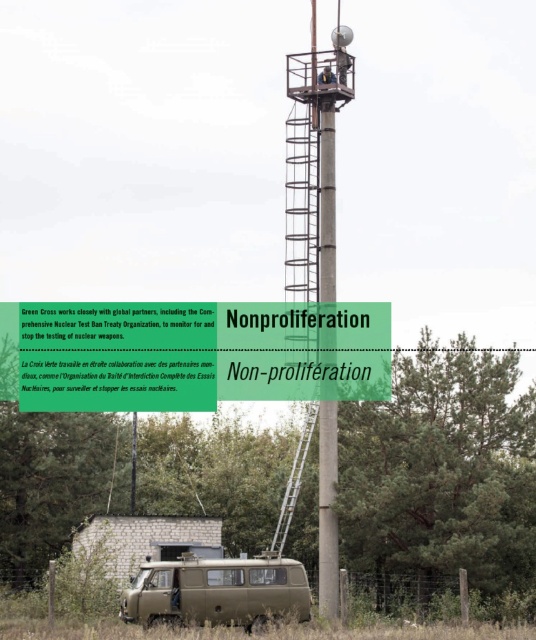
Is matte olive green van at lower center smaller than metallic silver ladder at center?

Indeed, matte olive green van at lower center has a smaller size compared to metallic silver ladder at center.

Is point (150, 561) positioned before point (306, 449)?

Yes, it is in front of point (306, 449).

Which is in front, point (293, 589) or point (307, 408)?

Point (293, 589)

This screenshot has height=640, width=536. What are the coordinates of `matte olive green van at lower center` in the screenshot? It's located at (217, 592).

Is point (26, 364) farther from viewer compared to point (301, 445)?

That is True.

Between green paper non-proliferation sign at upper center and metallic silver ladder at center, which one appears on the right side from the viewer's perspective?

→ From the viewer's perspective, metallic silver ladder at center appears more on the right side.

I want to click on green paper non-proliferation sign at upper center, so click(x=190, y=353).

You are a GUI agent. You are given a task and a screenshot of the screen. Output one action in this format:
    pyautogui.click(x=<x>, y=<y>)
    Task: Click on the green paper non-proliferation sign at upper center
    
    Given the screenshot: What is the action you would take?
    pyautogui.click(x=190, y=353)

Does green paper non-proliferation sign at upper center have a greater height compared to gray concrete tower at center?

In fact, green paper non-proliferation sign at upper center may be shorter than gray concrete tower at center.

Based on the photo, can you confirm if green paper non-proliferation sign at upper center is smaller than gray concrete tower at center?

Correct, green paper non-proliferation sign at upper center occupies less space than gray concrete tower at center.

The height and width of the screenshot is (640, 536). What do you see at coordinates (190, 353) in the screenshot?
I see `green paper non-proliferation sign at upper center` at bounding box center [190, 353].

I want to click on green paper non-proliferation sign at upper center, so click(190, 353).